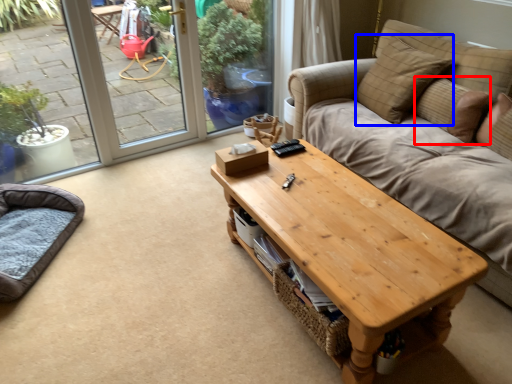
Question: Which object is further to the camera taking this photo, pillow (highlighted by a red box) or pillow (highlighted by a blue box)?

Choices:
 (A) pillow
 (B) pillow

Answer: (B)